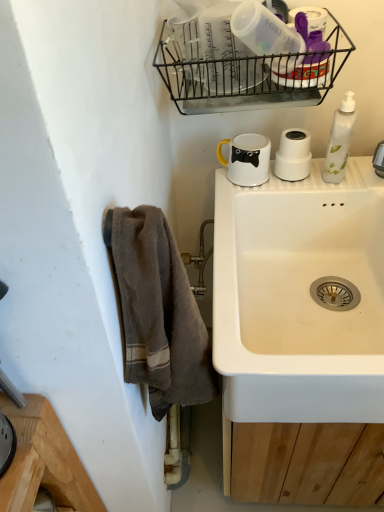
The width and height of the screenshot is (384, 512). Find the location of `vacant space to the right of white glossy bottle at right`. vacant space to the right of white glossy bottle at right is located at coordinates (361, 170).